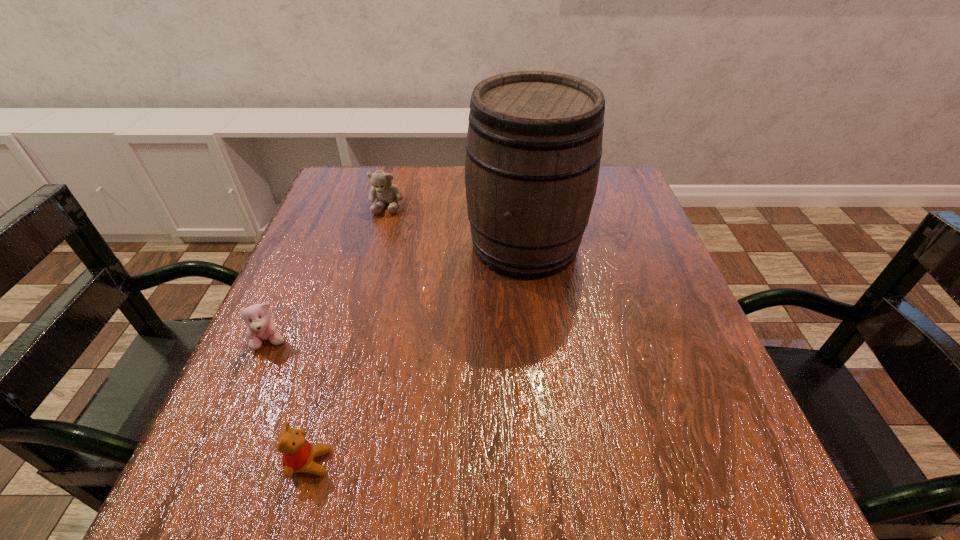
Where is `the rightmost object`? The image size is (960, 540). the rightmost object is located at coordinates (534, 144).

What are the coordinates of `the tallest object` in the screenshot? It's located at (534, 144).

The image size is (960, 540). Find the location of `the farthest teddy bear`. the farthest teddy bear is located at coordinates (382, 188).

This screenshot has width=960, height=540. Find the location of `the second nearest teddy bear`. the second nearest teddy bear is located at coordinates (261, 327).

You are a GUI agent. You are given a task and a screenshot of the screen. Output one action in this format:
    pyautogui.click(x=<x>, y=<y>)
    Task: Click on the second nearest object
    The width and height of the screenshot is (960, 540).
    Given the screenshot: What is the action you would take?
    click(x=261, y=327)

I want to click on the nearest teddy bear, so click(x=298, y=454).

At what (x,y) coordinates should I click in order to perform the action: click on vacant space situated on the front of the rightmost object. Please return your answer as a coordinate pair (x, y). This screenshot has height=540, width=960. Looking at the image, I should click on pyautogui.click(x=545, y=417).

I want to click on blank area located 0.210m on the face of the farthest teddy bear, so click(x=368, y=276).

The image size is (960, 540). What are the coordinates of `vacant region located at the face of the second farthest teddy bear` in the screenshot? It's located at (194, 514).

The image size is (960, 540). Find the location of `free location located on the front-facing side of the nearest object`. free location located on the front-facing side of the nearest object is located at coordinates (477, 462).